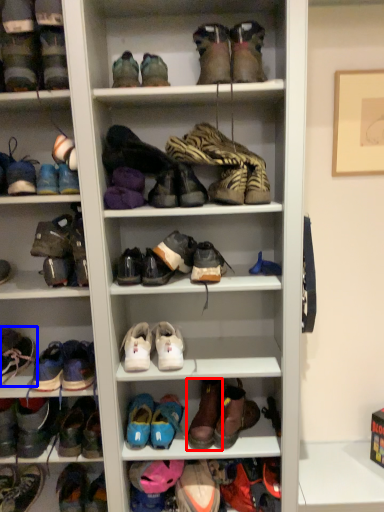
Question: Which point is further to the camera, shoe (highlighted by a red box) or footwear (highlighted by a blue box)?

Choices:
 (A) shoe
 (B) footwear

Answer: (A)